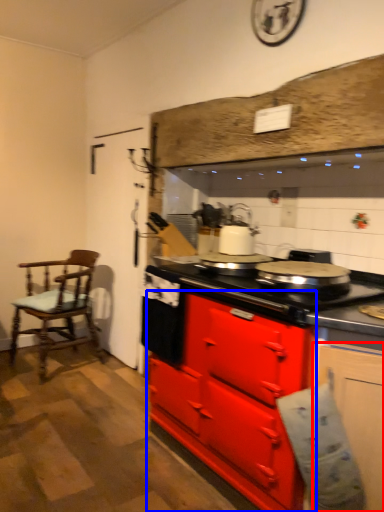
Question: Which object is further to the camera taking this photo, cabinetry (highlighted by a red box) or cabinetry (highlighted by a blue box)?

Choices:
 (A) cabinetry
 (B) cabinetry

Answer: (B)